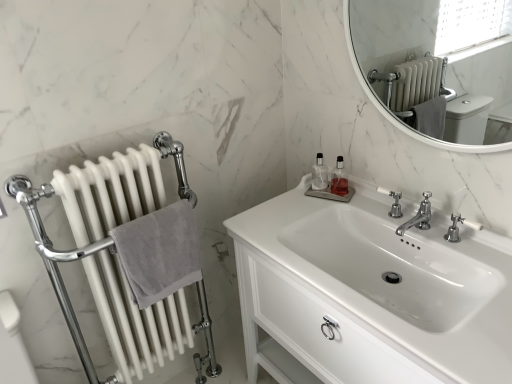
Identify the location of vacant area that lies between clear glass bottle at upper center, which is counted as the second toiletry, starting from the left, and polished chrome faucet at right, the second tap when ordered from left to right. (378, 215).